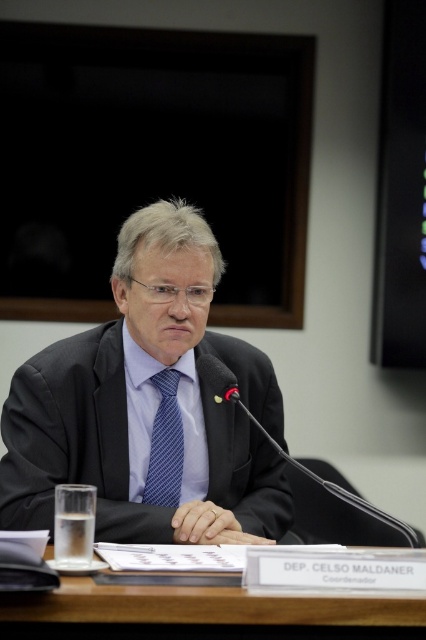
You are a robot assistant that is 0.8 meters wide. You need to move from the back of the room to the brown wooden table at center to deliver a document. Is there enough space for you to pass through the area between the table and the wall behind it?

The distance of brown wooden table at center from viewer is 1.08 meters, so yes, the robot can pass through the area between the table and the wall since the space is wider than the robot.

You are a photographer setting up for a group photo. You need to position the matte black suit at center and the brown wooden table at center so that the table is on the right side of the suit. Is the current arrangement correct?

The matte black suit at center is currently to the left of the brown wooden table at center, so the table is already on the right side of the suit. Therefore, the current arrangement is correct.

Based on the scene description, where is the matte black suit at center located in the image?

The matte black suit at center is located at point 0.636 on the x axis and 0.350 on the y axis.